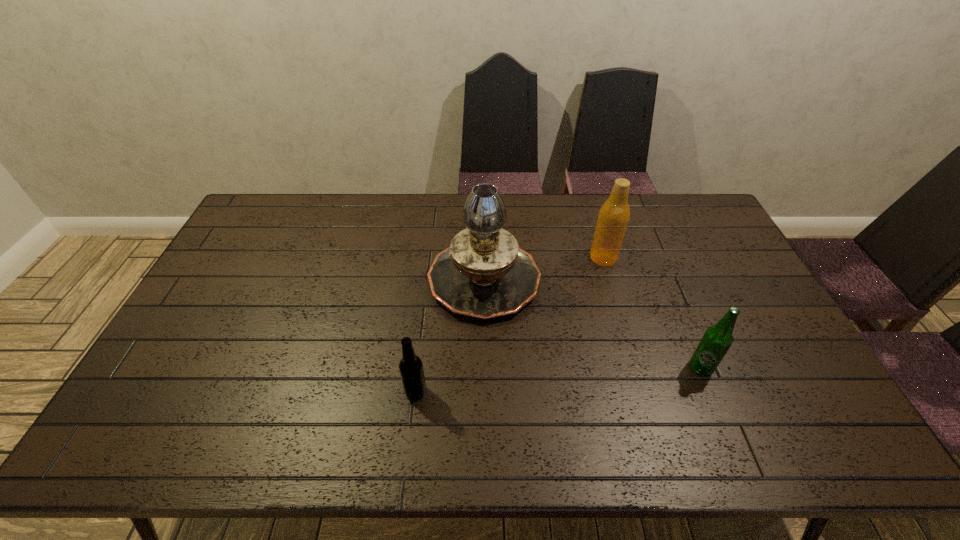
At what (x,y) coordinates should I click in order to perform the action: click on oil lamp. Please return your answer as a coordinate pair (x, y). The image size is (960, 540). Looking at the image, I should click on (484, 274).

The height and width of the screenshot is (540, 960). Find the location of `the second beer bottle from left to right`. the second beer bottle from left to right is located at coordinates (614, 215).

The image size is (960, 540). What are the coordinates of `the second object from right to left` in the screenshot? It's located at (614, 215).

The width and height of the screenshot is (960, 540). Find the location of `the second nearest object`. the second nearest object is located at coordinates (716, 341).

I want to click on the second nearest beer bottle, so click(x=716, y=341).

I want to click on the nearest object, so click(411, 369).

Image resolution: width=960 pixels, height=540 pixels. In order to click on the nearest beer bottle in this screenshot , I will do `click(411, 369)`.

Image resolution: width=960 pixels, height=540 pixels. Identify the location of free point located 0.190m on the right of the oil lamp. (600, 278).

Find the location of a particular element. vacant region located on the right of the third shortest object is located at coordinates (701, 258).

At what (x,y) coordinates should I click in order to perform the action: click on vacant space positioned 0.200m on the label of the rightmost beer bottle. Please return your answer as a coordinate pair (x, y). The height and width of the screenshot is (540, 960). Looking at the image, I should click on (736, 454).